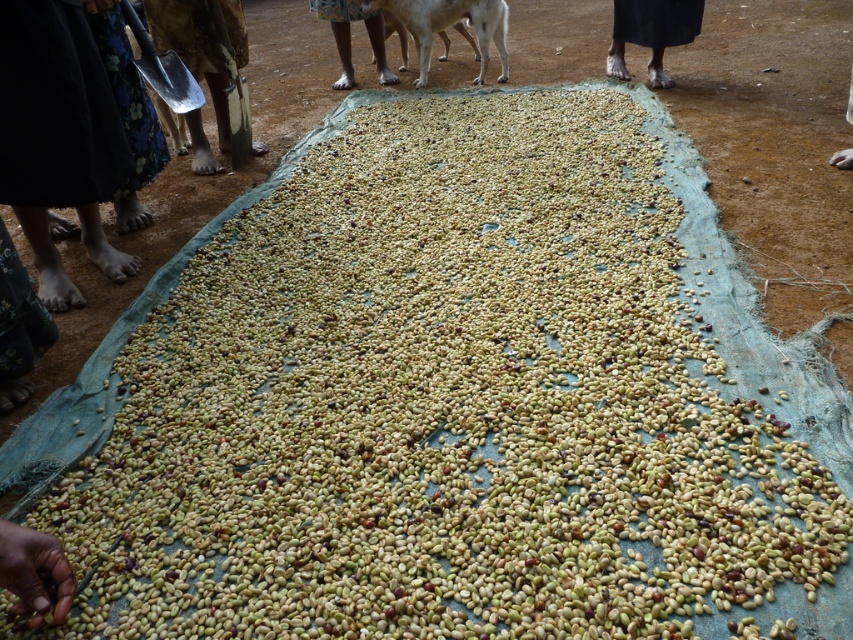
You are a worker at a coffee processing facility. You need to move the brown skin at center to the right side of the green matte beans at lower left. Is this possible given their current positions?

The green matte beans at lower left is to the left of brown skin at center, so moving the brown skin at center to the right side of the green matte beans at lower left would require moving it further to the right since it is already positioned to the right of them.

You are a farmer checking the drying process of the beans. You notice the green matte beans at lower left and the brown skin at center. Which object is positioned lower on the image?

The green matte beans at lower left is located below brown skin at center, so the green matte beans at lower left is positioned lower on the image.